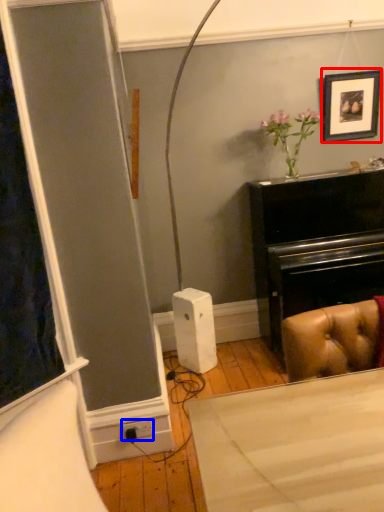
Question: Which object is further to the camera taking this photo, picture frame (highlighted by a red box) or plug (highlighted by a blue box)?

Choices:
 (A) picture frame
 (B) plug

Answer: (A)